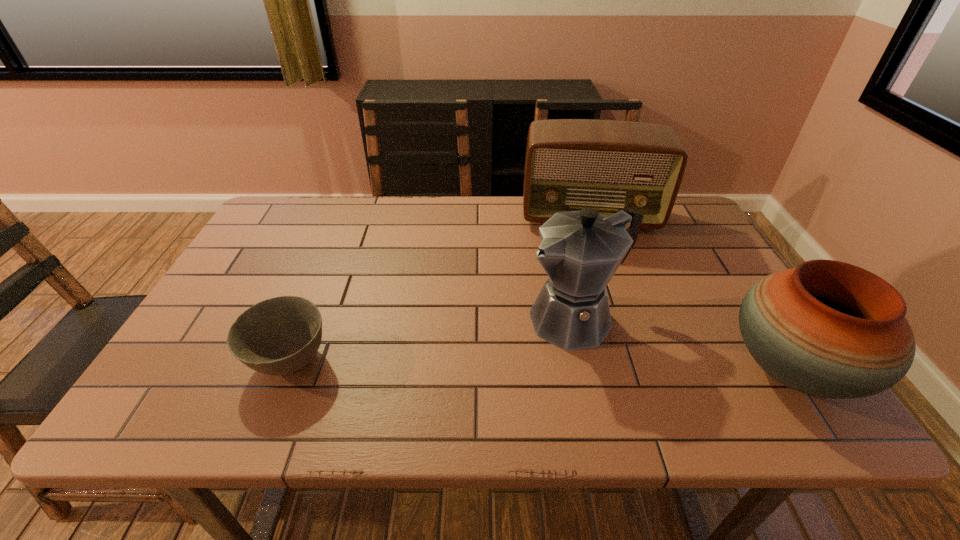
You are a GUI agent. You are given a task and a screenshot of the screen. Output one action in this format:
    pyautogui.click(x=<x>, y=<y>)
    Task: Click on the blank space that satisfies the following two spatial constraints: 1. on the front side of the coffeepot; 2. on the right side of the pottery
    The image size is (960, 540).
    Given the screenshot: What is the action you would take?
    pyautogui.click(x=588, y=369)

Find the location of a particular element. This screenshot has width=960, height=540. free space that satisfies the following two spatial constraints: 1. on the front side of the bowl; 2. on the left side of the second shortest object is located at coordinates (286, 369).

You are a GUI agent. You are given a task and a screenshot of the screen. Output one action in this format:
    pyautogui.click(x=<x>, y=<y>)
    Task: Click on the free space that satisfies the following two spatial constraints: 1. on the back side of the farthest object; 2. on the left side of the bowl
    Image resolution: width=960 pixels, height=540 pixels.
    Given the screenshot: What is the action you would take?
    pyautogui.click(x=348, y=218)